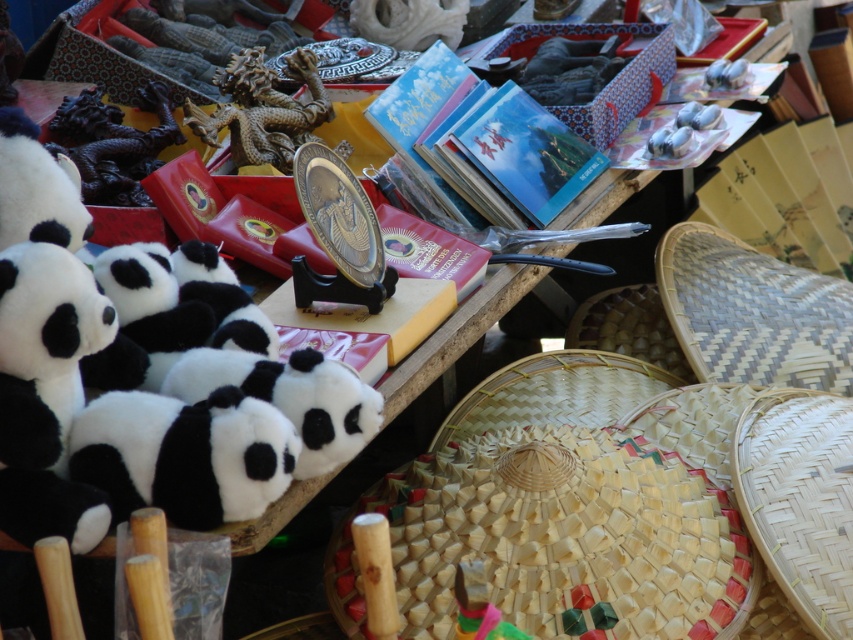
Does natural woven straw hat at lower right lie behind black plush panda at center?

Yes.

Looking at this image, can you confirm if natural woven straw hat at lower right is positioned above black plush panda at center?

Actually, natural woven straw hat at lower right is below black plush panda at center.

Describe the element at coordinates (566, 512) in the screenshot. This screenshot has width=853, height=640. I see `natural woven straw hat at lower right` at that location.

Find the location of a particular element. This screenshot has width=853, height=640. natural woven straw hat at lower right is located at coordinates (566, 512).

Is point (273, 417) closer to camera compared to point (811, 348)?

Yes, point (273, 417) is closer to viewer.

Can you confirm if black plush panda at center is shorter than woven bamboo basket at lower right?

Yes, black plush panda at center is shorter than woven bamboo basket at lower right.

Who is more distant from viewer, (287, 419) or (839, 346)?

The point (839, 346) is more distant.

Identify the location of black plush panda at center. This screenshot has height=640, width=853. (184, 454).

Which is behind, point (238, 460) or point (329, 106)?

Positioned behind is point (329, 106).

Image resolution: width=853 pixels, height=640 pixels. What do you see at coordinates (184, 454) in the screenshot?
I see `black plush panda at center` at bounding box center [184, 454].

Locate an element on the screen. The height and width of the screenshot is (640, 853). black plush panda at center is located at coordinates (184, 454).